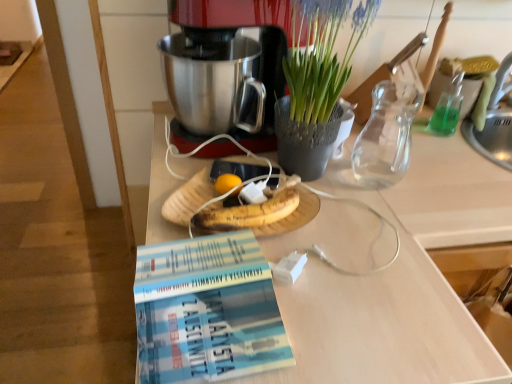
Question: From a real-world perspective, is green textured vase at upper center on transparent glass vase at upper right?

Choices:
 (A) yes
 (B) no

Answer: (A)

Question: Could you tell me if green textured vase at upper center is turned towards transparent glass vase at upper right?

Choices:
 (A) yes
 (B) no

Answer: (B)

Question: Does green textured vase at upper center have a lesser width compared to transparent glass vase at upper right?

Choices:
 (A) no
 (B) yes

Answer: (A)

Question: From a real-world perspective, is green textured vase at upper center positioned under transparent glass vase at upper right based on gravity?

Choices:
 (A) yes
 (B) no

Answer: (B)

Question: From the image's perspective, is green textured vase at upper center over transparent glass vase at upper right?

Choices:
 (A) yes
 (B) no

Answer: (A)

Question: In terms of size, does white matte desk at center appear bigger or smaller than green textured vase at upper center?

Choices:
 (A) big
 (B) small

Answer: (A)

Question: From a real-world perspective, is white matte desk at center positioned above or below green textured vase at upper center?

Choices:
 (A) below
 (B) above

Answer: (A)

Question: Is point [x=449, y=195] closer or farther from the camera than point [x=287, y=124]?

Choices:
 (A) farther
 (B) closer

Answer: (B)

Question: From the image's perspective, relative to green textured vase at upper center, is white matte desk at center above or below?

Choices:
 (A) above
 (B) below

Answer: (B)

Question: Looking at the image, does white matte desk at center seem bigger or smaller compared to blue paperback book at lower center?

Choices:
 (A) big
 (B) small

Answer: (A)

Question: From the image's perspective, is white matte desk at center above or below blue paperback book at lower center?

Choices:
 (A) above
 (B) below

Answer: (B)

Question: Is white matte desk at center taller or shorter than blue paperback book at lower center?

Choices:
 (A) tall
 (B) short

Answer: (A)

Question: Visually, is white matte desk at center positioned to the left or to the right of blue paperback book at lower center?

Choices:
 (A) left
 (B) right

Answer: (B)

Question: Is green textured vase at upper center wider or thinner than metallic silver coffee maker at center?

Choices:
 (A) thin
 (B) wide

Answer: (A)

Question: Would you say green textured vase at upper center is inside or outside metallic silver coffee maker at center?

Choices:
 (A) outside
 (B) inside

Answer: (A)